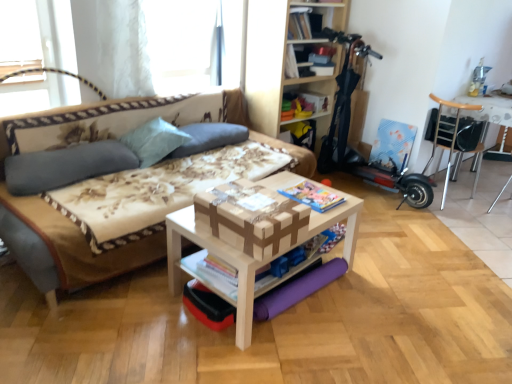
Question: Would you say matte gray pillow at left, the 1th pillow in the left-to-right sequence, is outside light blue fabric pillow at upper left, acting as the second pillow starting from the left?

Choices:
 (A) yes
 (B) no

Answer: (A)

Question: Could you tell me if matte gray pillow at left, which is the third pillow from right to left, is facing light blue fabric pillow at upper left, acting as the second pillow starting from the left?

Choices:
 (A) no
 (B) yes

Answer: (A)

Question: Is matte gray pillow at left, which is the third pillow from right to left, thinner than light blue fabric pillow at upper left, acting as the second pillow starting from the left?

Choices:
 (A) yes
 (B) no

Answer: (A)

Question: Is matte gray pillow at left, the 1th pillow in the left-to-right sequence, shorter than light blue fabric pillow at upper left, acting as the second pillow starting from the left?

Choices:
 (A) yes
 (B) no

Answer: (A)

Question: Is matte gray pillow at left, the 1th pillow in the left-to-right sequence, at the right side of light blue fabric pillow at upper left, the second pillow in the right-to-left sequence?

Choices:
 (A) yes
 (B) no

Answer: (B)

Question: In terms of size, does gray fabric pillow at upper center, arranged as the 1th pillow when viewed from the right, appear bigger or smaller than matte paper magazine at center, the second magazine from the bottom?

Choices:
 (A) big
 (B) small

Answer: (A)

Question: Considering the positions of gray fabric pillow at upper center, the third pillow positioned from the left, and matte paper magazine at center, the first magazine in the right-to-left sequence, in the image, is gray fabric pillow at upper center, the third pillow positioned from the left, wider or thinner than matte paper magazine at center, the first magazine in the right-to-left sequence,?

Choices:
 (A) thin
 (B) wide

Answer: (B)

Question: In the image, is gray fabric pillow at upper center, the third pillow positioned from the left, on the left side or the right side of matte paper magazine at center, which is the 1th magazine from top to bottom?

Choices:
 (A) left
 (B) right

Answer: (A)

Question: From the image's perspective, is gray fabric pillow at upper center, the third pillow positioned from the left, positioned above or below matte paper magazine at center, which is the 1th magazine from top to bottom?

Choices:
 (A) above
 (B) below

Answer: (A)

Question: From their relative heights in the image, would you say light blue fabric pillow at upper left, acting as the second pillow starting from the left, is taller or shorter than matte paper magazine at center, which is the 1th magazine from top to bottom?

Choices:
 (A) tall
 (B) short

Answer: (A)

Question: Visually, is light blue fabric pillow at upper left, the second pillow in the right-to-left sequence, positioned to the left or to the right of matte paper magazine at center, which is the 1th magazine from top to bottom?

Choices:
 (A) right
 (B) left

Answer: (B)

Question: In terms of width, does light blue fabric pillow at upper left, acting as the second pillow starting from the left, look wider or thinner when compared to matte paper magazine at center, which is the 1th magazine from top to bottom?

Choices:
 (A) thin
 (B) wide

Answer: (B)

Question: Relative to matte paper magazine at center, which is the 1th magazine from top to bottom, is light blue fabric pillow at upper left, the second pillow in the right-to-left sequence, in front or behind?

Choices:
 (A) front
 (B) behind

Answer: (B)

Question: Looking at the image, does brown cardboard box at center seem bigger or smaller compared to light blue fabric pillow at upper left, the second pillow in the right-to-left sequence?

Choices:
 (A) big
 (B) small

Answer: (B)

Question: Is brown cardboard box at center taller or shorter than light blue fabric pillow at upper left, acting as the second pillow starting from the left?

Choices:
 (A) tall
 (B) short

Answer: (B)